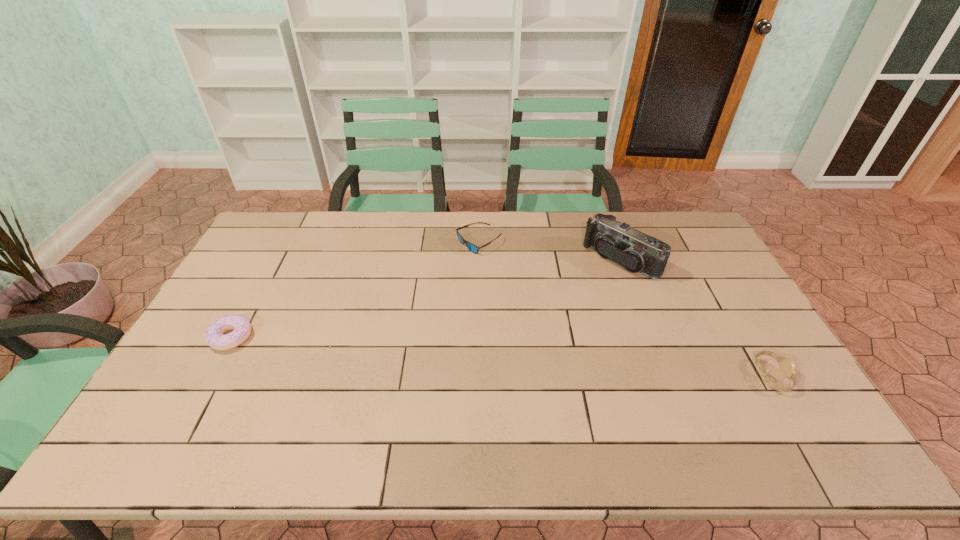
Locate an element on the screen. This screenshot has width=960, height=540. free space located 0.200m on the front-facing side of the tallest object is located at coordinates (564, 306).

Where is `vacant space located 0.200m at the front of the second object from left to right showing the lenses`? The height and width of the screenshot is (540, 960). vacant space located 0.200m at the front of the second object from left to right showing the lenses is located at coordinates click(x=451, y=295).

Where is `blank area located at the front of the second object from left to right showing the lenses`? The height and width of the screenshot is (540, 960). blank area located at the front of the second object from left to right showing the lenses is located at coordinates (463, 273).

The height and width of the screenshot is (540, 960). What are the coordinates of `blank space located at the front of the second object from left to right showing the lenses` in the screenshot? It's located at (448, 301).

Identify the location of camcorder that is positioned at the far edge. (636, 251).

Find the location of `sunglasses at the far edge`. sunglasses at the far edge is located at coordinates (473, 248).

Image resolution: width=960 pixels, height=540 pixels. What are the coordinates of `object that is at the near edge` in the screenshot? It's located at (787, 366).

Find the location of a particular element. Image resolution: width=960 pixels, height=540 pixels. object located in the left edge section of the desktop is located at coordinates (214, 336).

Where is `object situated at the right edge`? object situated at the right edge is located at coordinates (787, 366).

The width and height of the screenshot is (960, 540). Find the location of `object that is at the near right corner`. object that is at the near right corner is located at coordinates (787, 366).